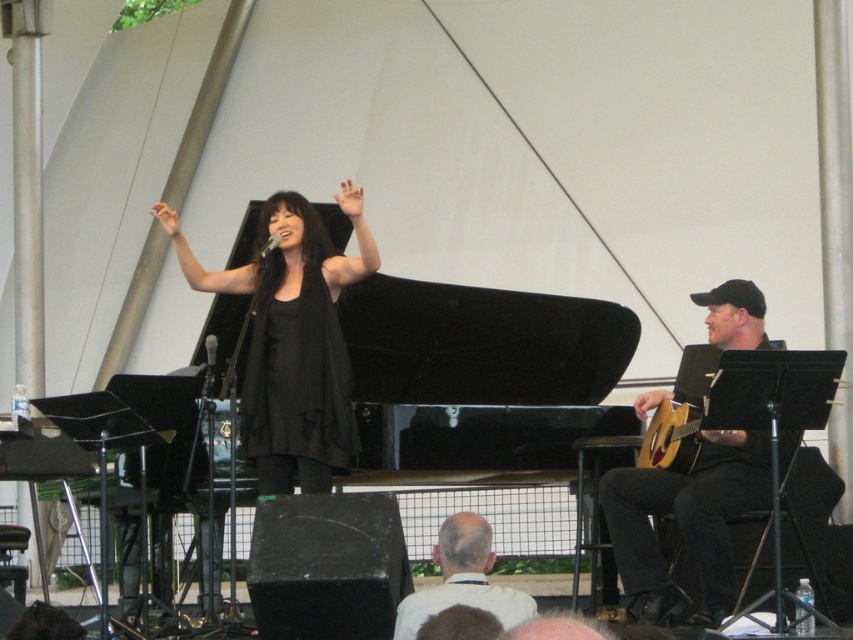
Question: Among these points, which one is nearest to the camera?

Choices:
 (A) (491, 540)
 (B) (302, 308)
 (C) (763, 410)

Answer: (A)

Question: Is black matte dress at center to the right of bald head at center from the viewer's perspective?

Choices:
 (A) no
 (B) yes

Answer: (A)

Question: Which is nearer to the black acoustic guitar at right?

Choices:
 (A) acoustic wood guitar at right
 (B) black matte dress at center
 (C) bald head at center

Answer: (A)

Question: Observing the image, what is the correct spatial positioning of black matte dress at center in reference to acoustic wood guitar at right?

Choices:
 (A) above
 (B) below

Answer: (A)

Question: Which point is closer to the camera?

Choices:
 (A) black acoustic guitar at right
 (B) acoustic wood guitar at right
 (C) bald head at center

Answer: (C)

Question: Is black matte dress at center to the right of black acoustic guitar at right from the viewer's perspective?

Choices:
 (A) no
 (B) yes

Answer: (A)